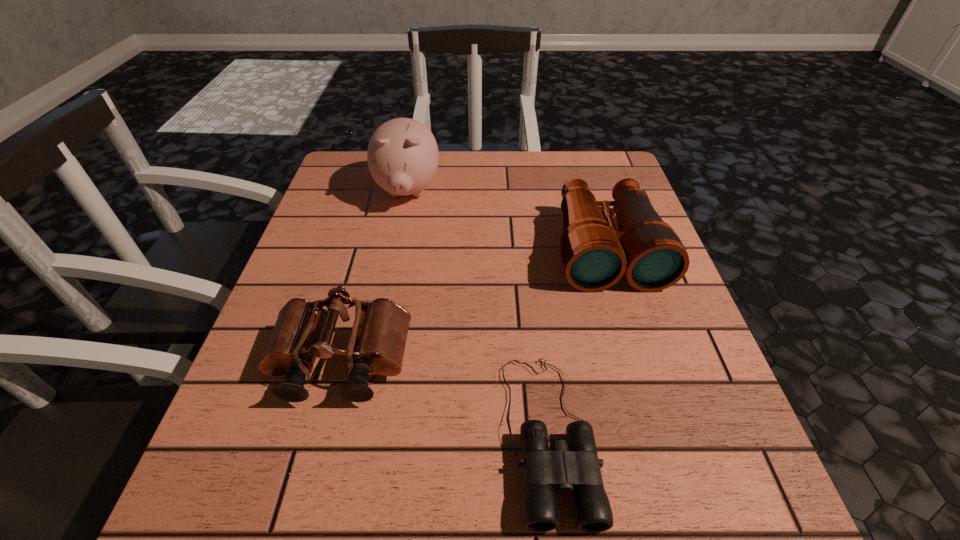
Locate an element on the screen. The height and width of the screenshot is (540, 960). binoculars positioned at the left edge is located at coordinates (303, 331).

Find the location of `object positioned at the right edge`. object positioned at the right edge is located at coordinates (595, 255).

Locate an element on the screen. This screenshot has width=960, height=540. object that is positioned at the far left corner is located at coordinates (402, 155).

This screenshot has width=960, height=540. In the image, there is a desktop. What are the coordinates of `vacant space at the far edge` in the screenshot? It's located at (510, 183).

Where is `vacant area at the near edge`? This screenshot has height=540, width=960. vacant area at the near edge is located at coordinates (346, 539).

This screenshot has width=960, height=540. Identify the location of vacant space at the left edge of the desktop. (316, 294).

Locate an element on the screen. vacant region at the right edge is located at coordinates (709, 443).

You are a GUI agent. You are given a task and a screenshot of the screen. Output one action in this format:
    pyautogui.click(x=<x>, y=<y>)
    Task: Click on the vacant space at the far left corner of the desktop
    The height and width of the screenshot is (540, 960).
    Given the screenshot: What is the action you would take?
    pyautogui.click(x=347, y=199)

Identify the location of vacant space at the near left corner of the desktop. The image size is (960, 540). (225, 472).

This screenshot has width=960, height=540. In order to click on vacant region at the far right corner of the desktop in this screenshot , I will do `click(572, 166)`.